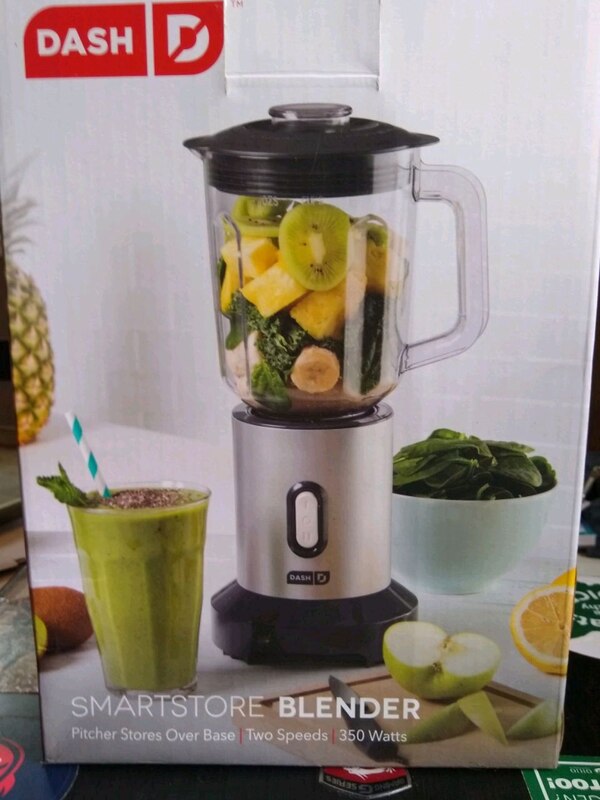
This screenshot has width=600, height=800. In order to click on cup in this screenshot , I will do `click(169, 545)`.